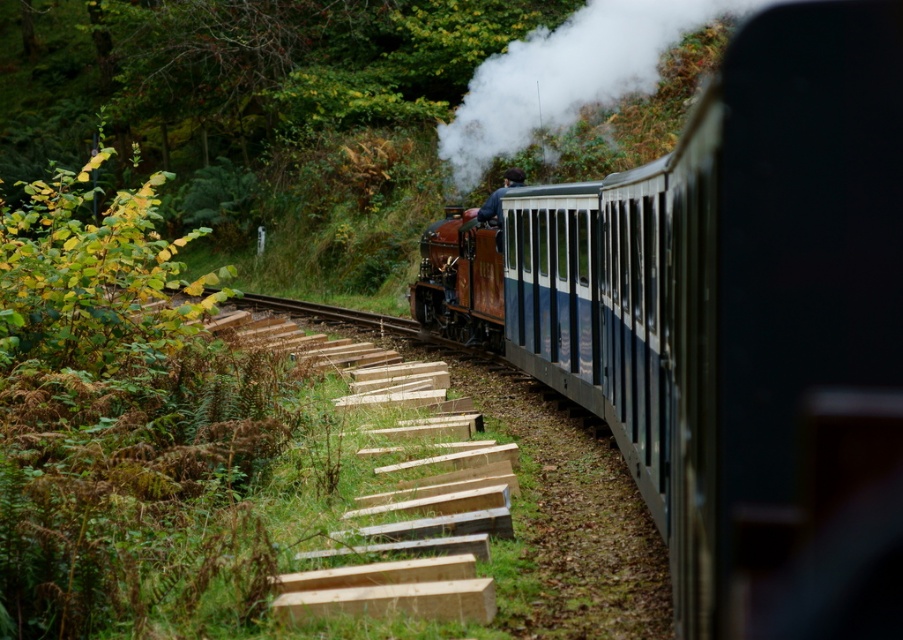
Is point (610, 12) farther from viewer compared to point (425, 275)?

Yes, it is behind point (425, 275).

Locate an element on the screen. The height and width of the screenshot is (640, 903). white smoke at upper center is located at coordinates (566, 74).

Image resolution: width=903 pixels, height=640 pixels. Identify the location of white smoke at upper center. (566, 74).

Is blue polished wood train at center to the right of rusty metal steam engine at center from the viewer's perspective?

Correct, you'll find blue polished wood train at center to the right of rusty metal steam engine at center.

Who is shorter, blue polished wood train at center or rusty metal steam engine at center?

rusty metal steam engine at center is shorter.

Who is more distant from viewer, (x=632, y=356) or (x=468, y=234)?

The point (x=468, y=234) is behind.

This screenshot has width=903, height=640. What are the coordinates of `blue polished wood train at center` in the screenshot? It's located at (734, 298).

Is point (852, 45) more distant than point (650, 49)?

No.

Which is more to the left, blue polished wood train at center or white smoke at upper center?

blue polished wood train at center is more to the left.

Find the location of a particular element. Image resolution: width=903 pixels, height=640 pixels. blue polished wood train at center is located at coordinates (734, 298).

The image size is (903, 640). I want to click on blue polished wood train at center, so click(734, 298).